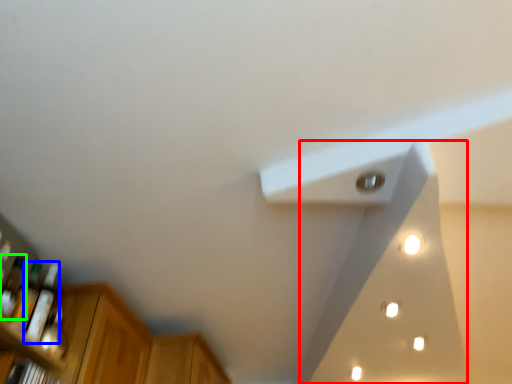
Question: Which is nearer to the exhaust hood (highlighted by a red box)? bottle (highlighted by a blue box) or bottle (highlighted by a green box).

Choices:
 (A) bottle
 (B) bottle

Answer: (A)